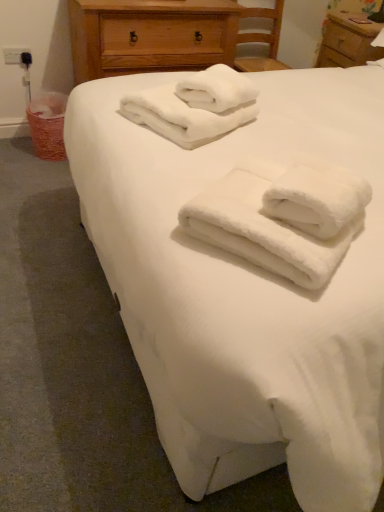
Question: Which direction should I rotate to look at white soft towels at upper center, which ranks as the 2th towel in front-to-back order?

Choices:
 (A) right
 (B) left

Answer: (B)

Question: Are white fluffy towels at center, which ranks as the 1th towel in front-to-back order, and wooden nightstand at upper right located far from each other?

Choices:
 (A) yes
 (B) no

Answer: (A)

Question: Is white fluffy towels at center, placed as the 1th towel when sorted from bottom to top, wider than wooden nightstand at upper right?

Choices:
 (A) no
 (B) yes

Answer: (B)

Question: Is white fluffy towels at center, which ranks as the second towel in top-to-bottom order, bigger than wooden nightstand at upper right?

Choices:
 (A) yes
 (B) no

Answer: (B)

Question: From a real-world perspective, is white fluffy towels at center, which ranks as the 1th towel in front-to-back order, over wooden nightstand at upper right?

Choices:
 (A) yes
 (B) no

Answer: (A)

Question: Is white fluffy towels at center, which ranks as the second towel in back-to-front order, thinner than wooden nightstand at upper right?

Choices:
 (A) no
 (B) yes

Answer: (A)

Question: Is white fluffy towels at center, which ranks as the 1th towel in front-to-back order, with wooden nightstand at upper right?

Choices:
 (A) no
 (B) yes

Answer: (A)

Question: Considering the relative sizes of black plastic outlet at upper left and white fluffy towels at center, which ranks as the second towel in back-to-front order, in the image provided, is black plastic outlet at upper left bigger than white fluffy towels at center, which ranks as the second towel in back-to-front order,?

Choices:
 (A) no
 (B) yes

Answer: (A)

Question: Is black plastic outlet at upper left oriented away from white fluffy towels at center, which ranks as the 1th towel in front-to-back order?

Choices:
 (A) no
 (B) yes

Answer: (A)

Question: Does black plastic outlet at upper left have a lesser width compared to white fluffy towels at center, which ranks as the second towel in top-to-bottom order?

Choices:
 (A) no
 (B) yes

Answer: (B)

Question: From the image's perspective, is black plastic outlet at upper left beneath white fluffy towels at center, placed as the 1th towel when sorted from bottom to top?

Choices:
 (A) yes
 (B) no

Answer: (B)

Question: Are black plastic outlet at upper left and white fluffy towels at center, which ranks as the second towel in back-to-front order, far apart?

Choices:
 (A) no
 (B) yes

Answer: (B)

Question: Is black plastic outlet at upper left not inside white fluffy towels at center, placed as the 1th towel when sorted from bottom to top?

Choices:
 (A) yes
 (B) no

Answer: (A)

Question: Is black plastic outlet at upper left not close to wooden chest of drawers at upper center?

Choices:
 (A) no
 (B) yes

Answer: (A)